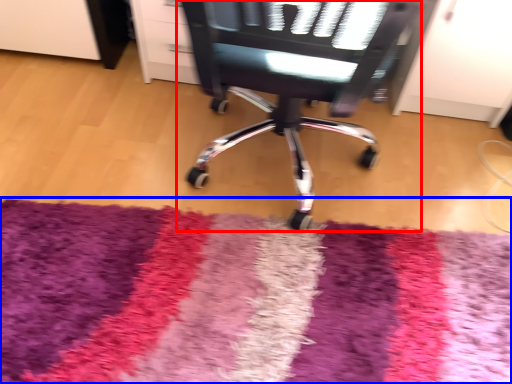
Question: Which object is further to the camera taking this photo, chair (highlighted by a red box) or mat (highlighted by a blue box)?

Choices:
 (A) chair
 (B) mat

Answer: (B)